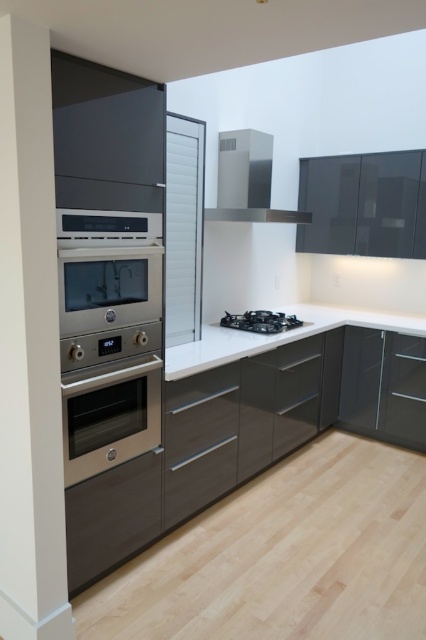
You are a kitchen designer planning to install a new microwave oven. You have two options for placement. The first option is to place the microwave oven above the satin stainless steel exhaust hood at upper center. The second option is to place it below the black matte stove at center. Considering the size relationship between these two objects, which placement would you choose and why?

The satin stainless steel exhaust hood at upper center has a larger size compared to the black matte stove at center. Therefore, placing the microwave oven above the satin stainless steel exhaust hood at upper center would be more suitable because the larger space can accommodate the microwave oven comfortably without overcrowding the area below the smaller black matte stove at center.

In the scene shown: You are a chef preparing to place a large baking tray on the counter. The tray is 60 centimeters wide. Based on the distance between the stainless steel oven at center and the white glossy countertop at center, will the tray fit on the countertop without overhanging the edge?

The stainless steel oven at center and white glossy countertop at center are 59.74 centimeters apart. Since the tray is 60 centimeters wide, it will slightly overhang the edge of the countertop by approximately 0.26 centimeters.

You are a chef preparing to place a large pot on the countertop. The pot is too heavy to lift, so you need to slide it from the right side of the white glossy countertop at center towards the stainless steel oven at center. Is the pot able to slide all the way to the oven without falling off the countertop?

The stainless steel oven at center is positioned on the left side of the white glossy countertop at center, so sliding the pot from the right side of the countertop towards the oven would require moving it towards the left. Since the oven is on the left side of the countertop, the pot can slide towards it without falling off as long as there is enough space between the right edge of the countertop and the oven.